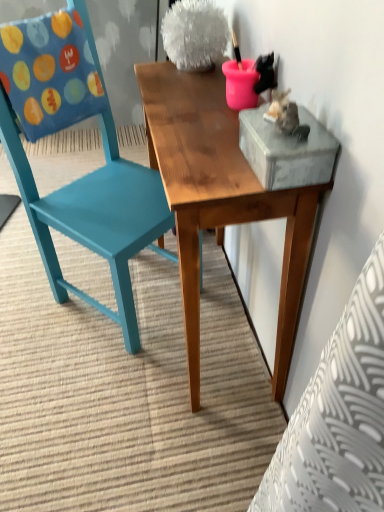
This screenshot has width=384, height=512. What do you see at coordinates (84, 176) in the screenshot?
I see `teal painted wood chair at left` at bounding box center [84, 176].

Where is `teal painted wood chair at left`? Image resolution: width=384 pixels, height=512 pixels. teal painted wood chair at left is located at coordinates (84, 176).

At what (x,y) coordinates should I click in order to perform the action: click on wooden table at center. Please return your answer as a coordinate pair (x, y). The height and width of the screenshot is (512, 384). Looking at the image, I should click on (220, 196).

What is the approximate height of wooden table at center?

It is 29.70 inches.

Describe the element at coordinates (220, 196) in the screenshot. I see `wooden table at center` at that location.

Find the location of `teal painted wood chair at left`. teal painted wood chair at left is located at coordinates (84, 176).

Does wooden table at center appear on the right side of teal painted wood chair at left?

Yes.

Relative to teal painted wood chair at left, is wooden table at center in front or behind?

wooden table at center is in front of teal painted wood chair at left.

Considering the points (248, 214) and (132, 208), which point is behind, point (248, 214) or point (132, 208)?

Point (132, 208)

From the picture: From the image's perspective, is wooden table at center above or below teal painted wood chair at left?

From the image's perspective, wooden table at center appears below teal painted wood chair at left.

From the picture: From a real-world perspective, which is physically below, wooden table at center or teal painted wood chair at left?

In real-world perspective, wooden table at center is lower.

Which of these two, wooden table at center or teal painted wood chair at left, is wider?

Wider between the two is teal painted wood chair at left.

Considering the sizes of objects wooden table at center and teal painted wood chair at left in the image provided, who is shorter, wooden table at center or teal painted wood chair at left?

wooden table at center.

Considering the relative sizes of wooden table at center and teal painted wood chair at left in the image provided, is wooden table at center bigger than teal painted wood chair at left?

No, wooden table at center is not bigger than teal painted wood chair at left.

Does wooden table at center contain teal painted wood chair at left?

No, teal painted wood chair at left is not a part of wooden table at center.

Is wooden table at center placed right next to teal painted wood chair at left?

There is a gap between wooden table at center and teal painted wood chair at left.

Could you tell me if wooden table at center is turned towards teal painted wood chair at left?

Yes, wooden table at center is oriented towards teal painted wood chair at left.

Can you tell me how much wooden table at center and teal painted wood chair at left differ in facing direction?

There is a 130-degree angle between the facing directions of wooden table at center and teal painted wood chair at left.

Measure the distance from wooden table at center to teal painted wood chair at left.

wooden table at center and teal painted wood chair at left are 13.00 inches apart.

Find the location of a particular element. The image size is (384, 512). chair that is above the wooden table at center (from the image's perspective) is located at coordinates (84, 176).

Can you confirm if teal painted wood chair at left is positioned to the left of wooden table at center?

Correct, you'll find teal painted wood chair at left to the left of wooden table at center.

Relative to wooden table at center, is teal painted wood chair at left in front or behind?

Clearly, teal painted wood chair at left is behind wooden table at center.

Which is closer to the camera, (61, 275) or (300, 229)?

Point (300, 229)

From the image's perspective, is teal painted wood chair at left located beneath wooden table at center?

No.

Looking at this image, from a real-world perspective, is teal painted wood chair at left physically located above or below wooden table at center?

teal painted wood chair at left is above wooden table at center.

Based on the photo, which object is thinner, teal painted wood chair at left or wooden table at center?

With smaller width is wooden table at center.

Is teal painted wood chair at left taller or shorter than wooden table at center?

teal painted wood chair at left is taller than wooden table at center.

Between teal painted wood chair at left and wooden table at center, which one has smaller size?

Smaller between the two is wooden table at center.

Does teal painted wood chair at left contain wooden table at center?

No, wooden table at center is not inside teal painted wood chair at left.

Is teal painted wood chair at left next to wooden table at center and touching it?

No.

Is teal painted wood chair at left turned away from wooden table at center?

teal painted wood chair at left is not turned away from wooden table at center.

Can you tell me how much teal painted wood chair at left and wooden table at center differ in facing direction?

The facing directions of teal painted wood chair at left and wooden table at center are 130 degrees apart.

Measure the distance between teal painted wood chair at left and wooden table at center.

The distance of teal painted wood chair at left from wooden table at center is 33.02 centimeters.

Where is `chair lying on the left of wooden table at center`? chair lying on the left of wooden table at center is located at coordinates click(84, 176).

Locate an element on the screen. This screenshot has height=512, width=384. chair that appears on the left of wooden table at center is located at coordinates (84, 176).

This screenshot has width=384, height=512. Find the location of `chair lying behind the wooden table at center`. chair lying behind the wooden table at center is located at coordinates tap(84, 176).